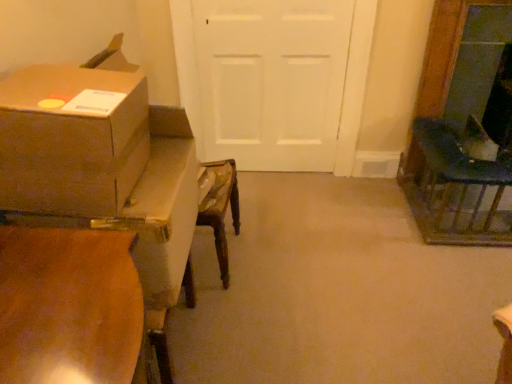
Question: Is dark green fabric chair at right spatially inside wooden table at left, or outside of it?

Choices:
 (A) outside
 (B) inside

Answer: (A)

Question: Is dark green fabric chair at right taller or shorter than wooden table at left?

Choices:
 (A) tall
 (B) short

Answer: (B)

Question: Estimate the real-world distances between objects in this image. Which object is closer to the wooden table at left?

Choices:
 (A) brown cardboard box at left
 (B) dark green fabric chair at right
 (C) white matte door at center

Answer: (A)

Question: Estimate the real-world distances between objects in this image. Which object is farther from the dark green fabric chair at right?

Choices:
 (A) brown cardboard box at left
 (B) wooden table at left
 (C) white matte door at center

Answer: (A)